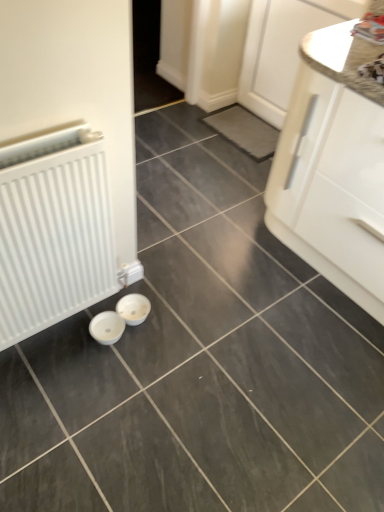
Locate an element on the screen. Image resolution: width=384 pixels, height=512 pixels. vacant area situated below white matte radiator at left (from a real-world perspective) is located at coordinates (50, 340).